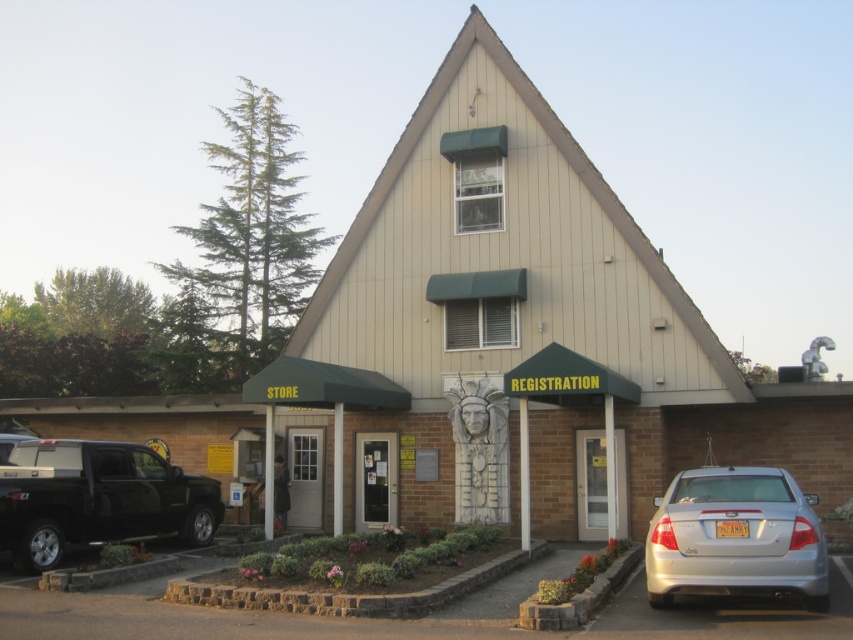
You are a delivery driver who needs to park your vehicle in the parking lot behind the building. The parking space you want to use is only 4 meters long. You have a silver metallic sedan at lower right and a shiny black truck at lower left. Which vehicle can fit into the space?

The silver metallic sedan at lower right is shorter than the shiny black truck at lower left, so the silver metallic sedan at lower right can fit into the 4 meter parking space since it is shorter.

You are a pedestrian standing in front of the registration office. You see a silver metallic sedan at lower right and a shiny black truck at lower left. Which vehicle is closer to you?

The silver metallic sedan at lower right is closer to you because it is in front of the shiny black truck at lower left.